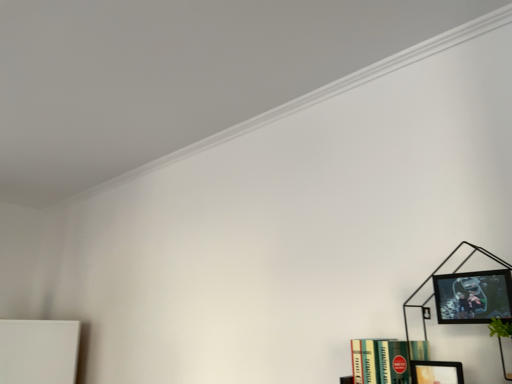
Question: Looking at their shapes, would you say black matte bookcase at right is wider or thinner than matte black picture frame at upper right, which is the 2th picture frame from bottom to top?

Choices:
 (A) thin
 (B) wide

Answer: (B)

Question: Is black matte bookcase at right inside or outside of matte black picture frame at upper right, the 1th picture frame in the top-to-bottom sequence?

Choices:
 (A) outside
 (B) inside

Answer: (A)

Question: Estimate the real-world distances between objects in this image. Which object is farther from the matte black picture frame at lower right, which is the second picture frame from top to bottom?

Choices:
 (A) green matte book at lower right
 (B) black matte bookcase at right
 (C) matte black picture frame at upper right, which is the 2th picture frame from bottom to top

Answer: (C)

Question: Which object is the farthest from the black matte bookcase at right?

Choices:
 (A) matte black picture frame at lower right, which is the second picture frame from top to bottom
 (B) matte black picture frame at upper right, the 1th picture frame in the top-to-bottom sequence
 (C) green matte book at lower right

Answer: (B)